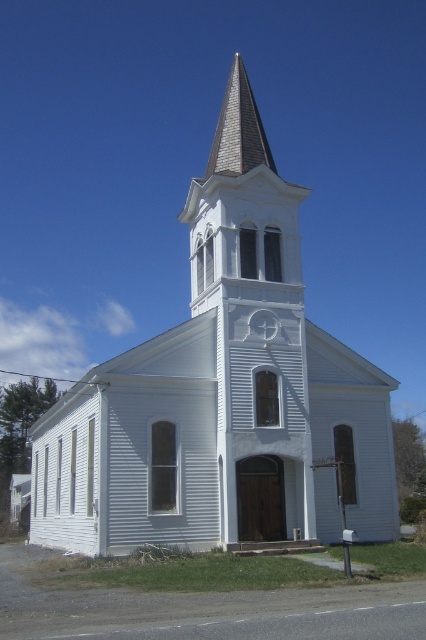
Looking at the church in the image, where is the gray shingles steeple at center in relation to the gray shingles at upper center?

The gray shingles steeple at center is to the left of the gray shingles at upper center.

You are an architect examining the church and notice two areas with gray shingles. The first is the gray shingles steeple at center and the second is the gray shingles at upper center. Which of these two areas has a larger size?

The gray shingles steeple at center is larger in size than the gray shingles at upper center.